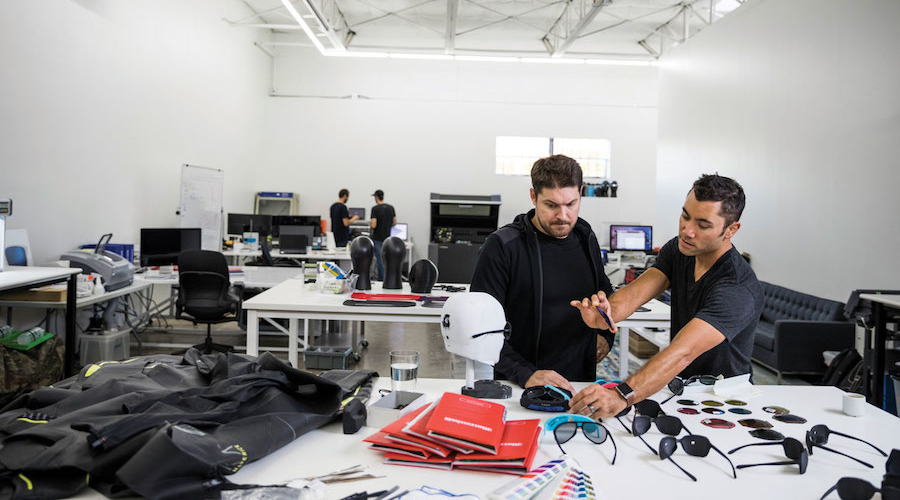
Image resolution: width=900 pixels, height=500 pixels. Find the location of `ceiling`. ceiling is located at coordinates (393, 28).